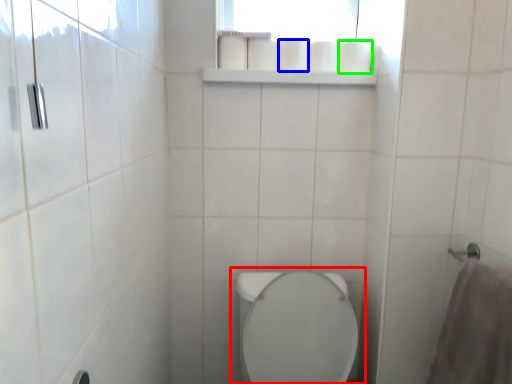
Question: Considering the real-world distances, which object is closest to toilet (highlighted by a red box)? toilet paper (highlighted by a blue box) or toilet paper (highlighted by a green box).

Choices:
 (A) toilet paper
 (B) toilet paper

Answer: (A)